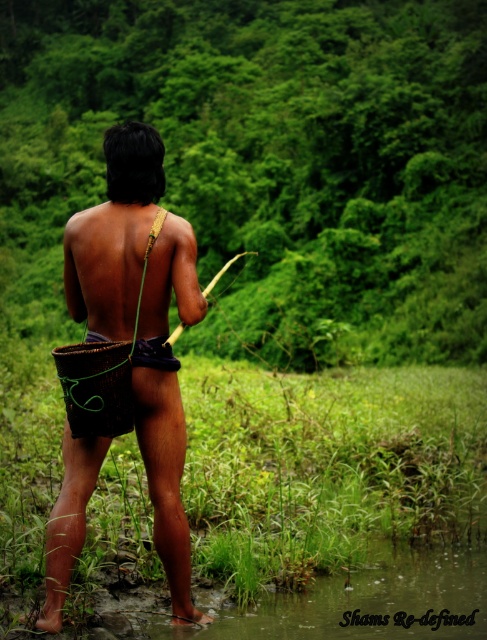
From the picture: Who is positioned more to the left, green leafy vegetation at center or brown woven basket at center?

brown woven basket at center is more to the left.

Between point (295, 248) and point (158, 436), which one is positioned behind?

Point (295, 248)

This screenshot has height=640, width=487. Describe the element at coordinates (265, 163) in the screenshot. I see `green leafy vegetation at center` at that location.

In order to click on green leafy vegetation at center in this screenshot , I will do `click(265, 163)`.